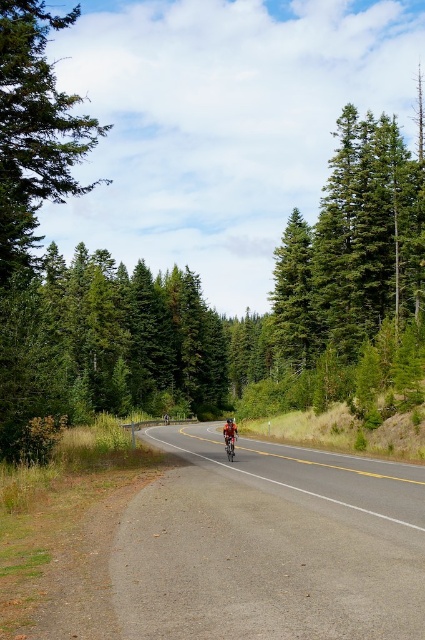
Who is taller, green textured pine tree at left or shiny red bicycle at center?

green textured pine tree at left is taller.

Which is below, green textured pine tree at left or shiny red bicycle at center?

shiny red bicycle at center is below.

Find the location of a particular element. This screenshot has height=640, width=425. green textured pine tree at left is located at coordinates (34, 129).

Which of these two, smooth asphalt road at center or shiny red bicycle at center, stands taller?

smooth asphalt road at center

Consider the image. Which is below, smooth asphalt road at center or shiny red bicycle at center?

Positioned lower is shiny red bicycle at center.

Does point (184, 620) come closer to viewer compared to point (232, 428)?

Yes, it is in front of point (232, 428).

This screenshot has width=425, height=640. Identify the location of smooth asphalt road at center. (269, 547).

Does smooth asphalt road at center appear on the right side of green textured pine tree at left?

Yes, smooth asphalt road at center is to the right of green textured pine tree at left.

Between smooth asphalt road at center and green textured pine tree at left, which one appears on the left side from the viewer's perspective?

green textured pine tree at left is more to the left.

Does point (288, 515) come in front of point (14, 26)?

That is True.

You are a GUI agent. You are given a task and a screenshot of the screen. Output one action in this format:
    pyautogui.click(x=<x>, y=<y>)
    Task: Click on the smooth asphalt road at center
    Image resolution: width=425 pixels, height=640 pixels.
    Given the screenshot: What is the action you would take?
    pyautogui.click(x=269, y=547)